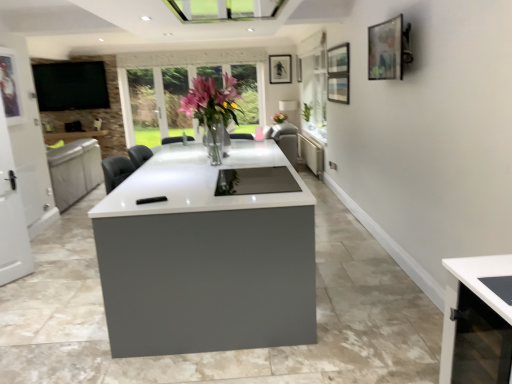
I want to click on vacant region in front of white glossy door at left, so click(x=12, y=292).